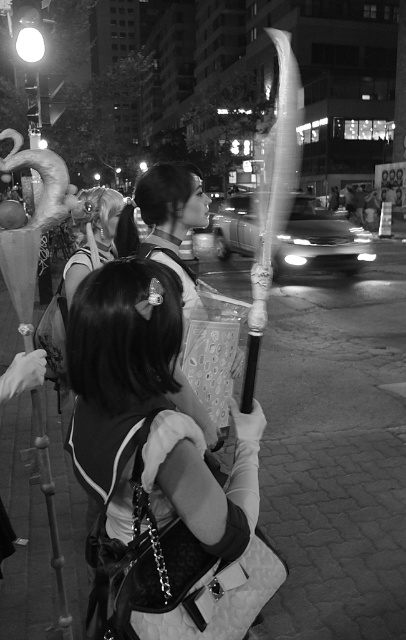
Question: Which point is closer to the camera?

Choices:
 (A) (174, 452)
 (B) (32, 100)
 (C) (95, 212)

Answer: (A)

Question: Is smooth white cane at upper center thinner than metallic streetlight at upper left?

Choices:
 (A) no
 (B) yes

Answer: (A)

Question: Can you confirm if smooth white cane at upper center is bigger than metallic streetlight at upper left?

Choices:
 (A) no
 (B) yes

Answer: (B)

Question: In this image, where is smooth white cane at upper center located relative to shiny silver hair at center?

Choices:
 (A) below
 (B) above

Answer: (B)

Question: Which point appears farthest from the camera in this image?

Choices:
 (A) (168, 189)
 (B) (114, 452)

Answer: (A)

Question: Which point is closer to the camera taking this photo?

Choices:
 (A) (269, 141)
 (B) (21, 58)
 (C) (66, 291)

Answer: (C)